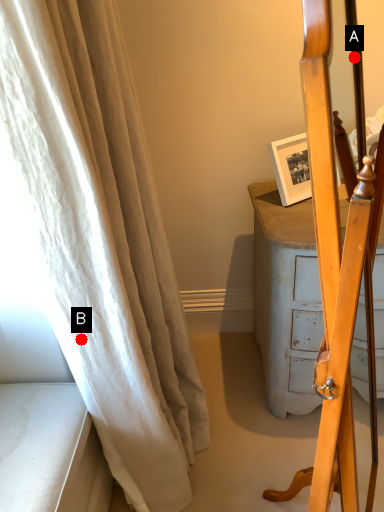
Question: Two points are circled on the image, labeled by A and B beside each circle. Which of the following is the farthest from the observer?

Choices:
 (A) A is further
 (B) B is further

Answer: (B)